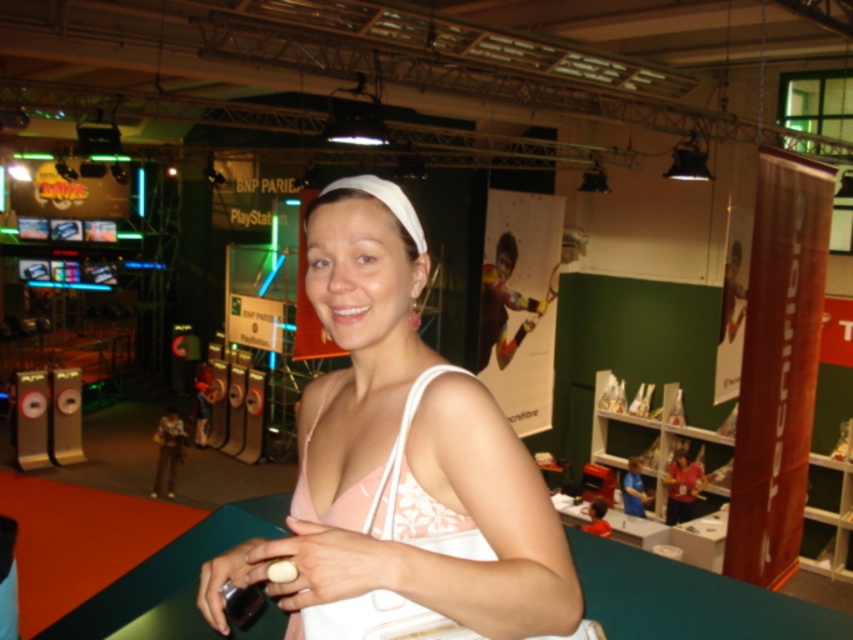
Consider the image. You are attending a fashion show and see two items at the center of the stage. The white fabric purse at center and the pink fabric dress at center. From the audience perspective, which item is positioned to the left?

The white fabric purse at center is positioned to the left of the pink fabric dress at center.

You are a photographer at the event and need to capture a closeup shot of both the white fabric purse at center and the pink fabric dress at center in the same frame. Can you fit both items in the shot if your camera has a minimum focus distance of 4 centimeters?

The white fabric purse at center is only 3.99 centimeters away from the pink fabric dress at center, which is within the camera minimum focus distance of 4 centimeters. Therefore, both items can be captured in the same frame.